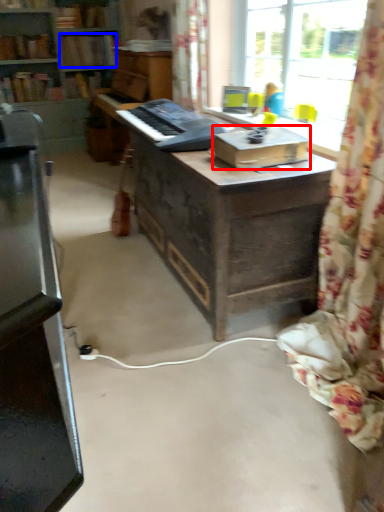
Question: Which object appears farthest to the camera in this image, cardboard box (highlighted by a red box) or book (highlighted by a blue box)?

Choices:
 (A) cardboard box
 (B) book

Answer: (B)